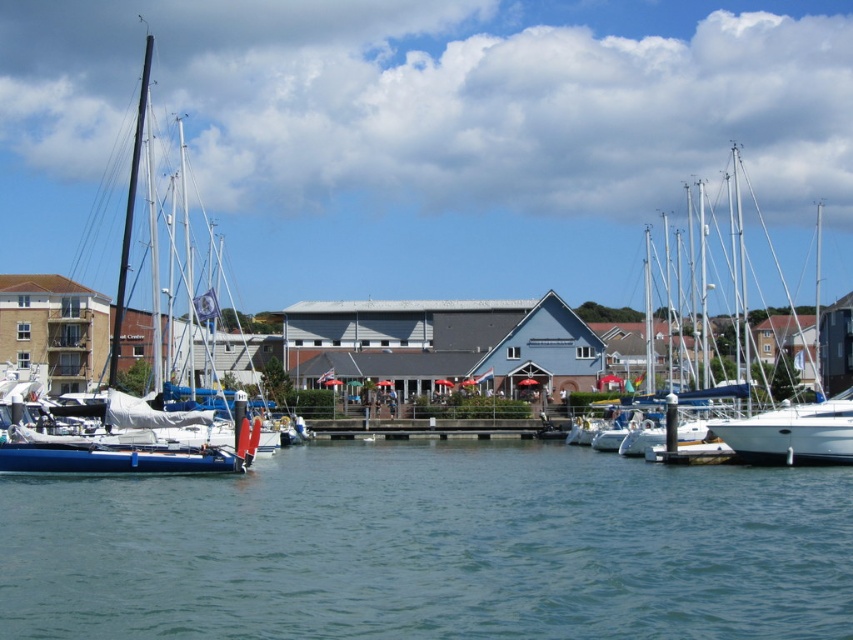
You are standing at the edge of the marina and want to determine the relative positions of two points marked in the scene. Which point is closer to you, point (763, 420) or point (123, 461)?

Point (763, 420) is further to the viewer than point (123, 461), so the closer point to you is point (123, 461).

You are a photographer planning to take a photo of the white glossy sailboat at right and the white matte sailboat at left from a position where both are visible. Based on their heights, which boat would appear shorter in the photo?

The white glossy sailboat at right would appear shorter in the photo because it has a lesser height compared to the white matte sailboat at left.